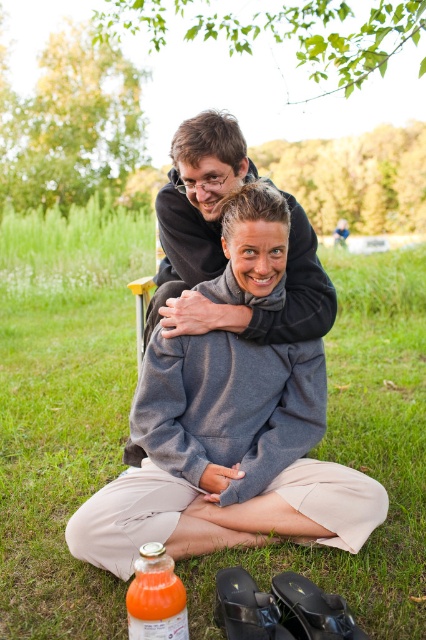
You are standing in the grassy area and want to place a small picnic basket on the green grass at center without it touching the black soft sweatshirt at center. Is this possible?

The green grass at center is positioned over the black soft sweatshirt at center, so placing the picnic basket on the green grass at center would not touch the black soft sweatshirt at center since it is above it.

You are at a park and see the black soft sweatshirt at center and the translucent orange liquid at lower center. Which object is closer to you?

The black soft sweatshirt at center is closer to you because the translucent orange liquid at lower center is behind it.